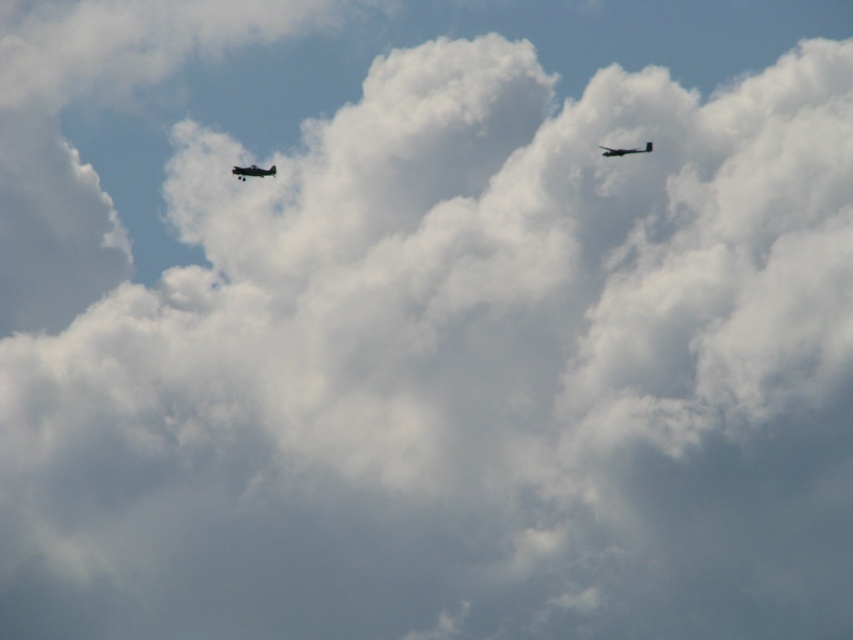
You are a pilot flying a small aircraft and need to land at an airport. You see the shiny silver airplane at upper left and the metallic gray airplane at upper right in the sky. Which airplane is closer to the ground?

The shiny silver airplane at upper left is positioned under the metallic gray airplane at upper right, so it is closer to the ground.

You are a pilot observing the shiny silver airplane at upper left and the metallic gray airplane at upper right. Which airplane would appear closer to you if both are at the same altitude?

The shiny silver airplane at upper left would appear closer because it is smaller than the metallic gray airplane at upper right, so if they were at the same altitude, the smaller one would be perceived as nearer due to its size.